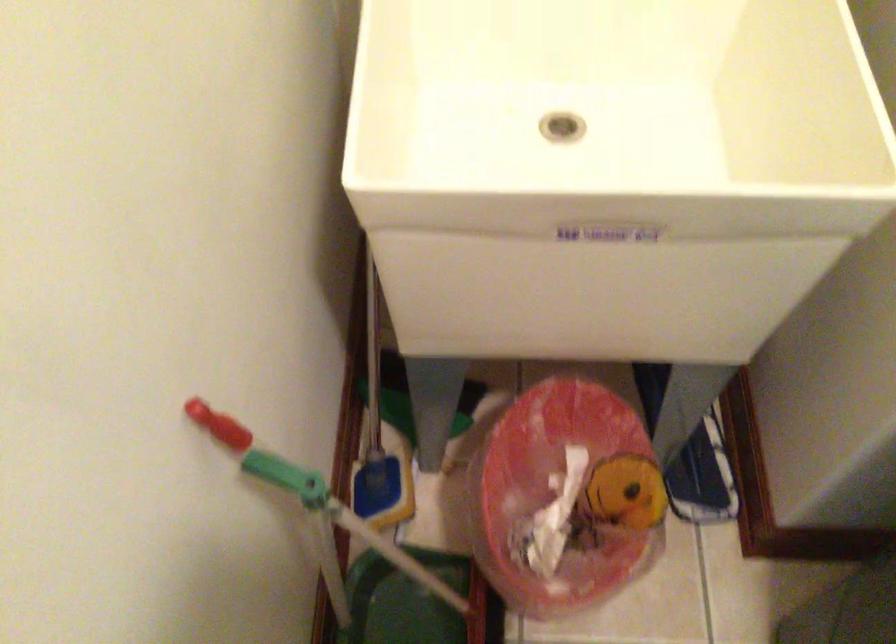
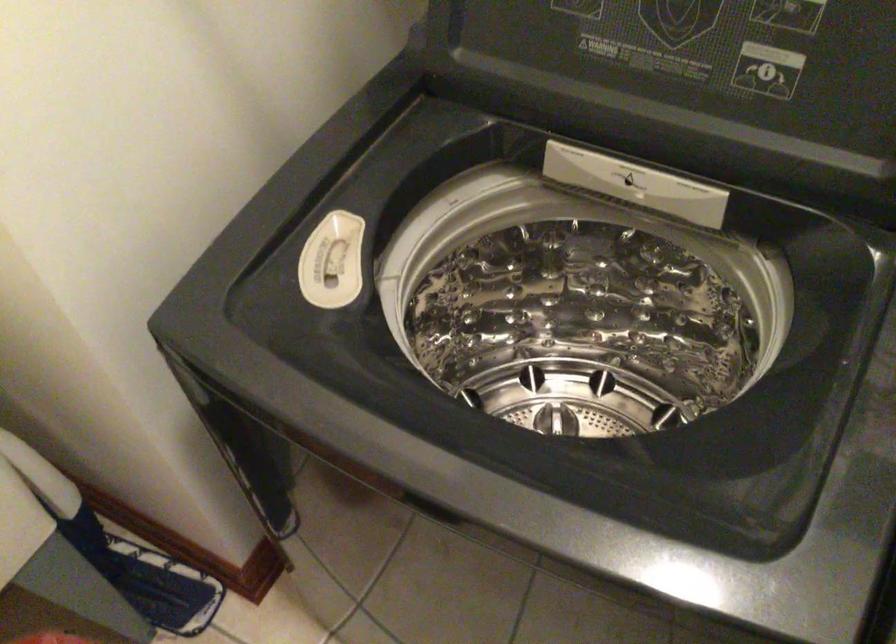
Question: The camera is either moving clockwise (left) or counter-clockwise (right) around the object. The first image is from the beginning of the video and the second image is from the end. Is the camera moving left or right when shooting the video?

Choices:
 (A) Left
 (B) Right

Answer: (A)